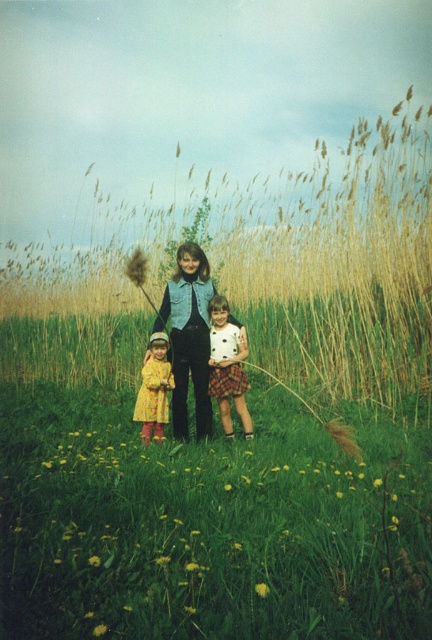
From the picture: Can you confirm if denim vest at center is shorter than white polka dot blouse at center?

No, denim vest at center is not shorter than white polka dot blouse at center.

Find the location of a particular element. The height and width of the screenshot is (640, 432). denim vest at center is located at coordinates (189, 337).

What do you see at coordinates (189, 337) in the screenshot? I see `denim vest at center` at bounding box center [189, 337].

Locate an element on the screen. denim vest at center is located at coordinates (189, 337).

Which is behind, point (193, 252) or point (158, 420)?

The point (158, 420) is behind.

Does denim vest at center appear under yellow cotton dress at center?

Incorrect, denim vest at center is not positioned below yellow cotton dress at center.

Describe the element at coordinates (189, 337) in the screenshot. The height and width of the screenshot is (640, 432). I see `denim vest at center` at that location.

Find the location of `denim vest at center`. denim vest at center is located at coordinates (189, 337).

Consider the image. Does white polka dot blouse at center come in front of yellow cotton dress at center?

No, it is not.

Who is more forward, (215, 321) or (155, 349)?

Point (155, 349) is in front.

Who is more distant from viewer, (216, 337) or (149, 428)?

Positioned behind is point (216, 337).

Identify the location of white polka dot blouse at center. The width and height of the screenshot is (432, 640). [228, 365].